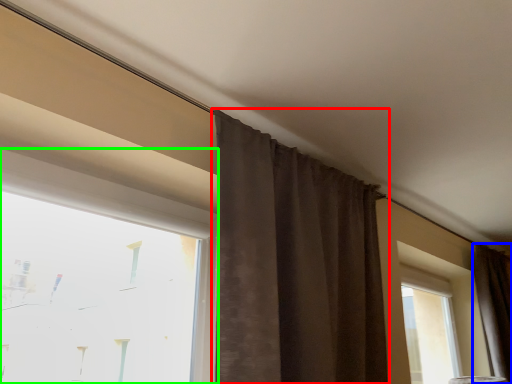
Question: Which object is the closest to the curtain (highlighted by a red box)? Choose among these: curtain (highlighted by a blue box) or window (highlighted by a green box).

Choices:
 (A) curtain
 (B) window

Answer: (B)